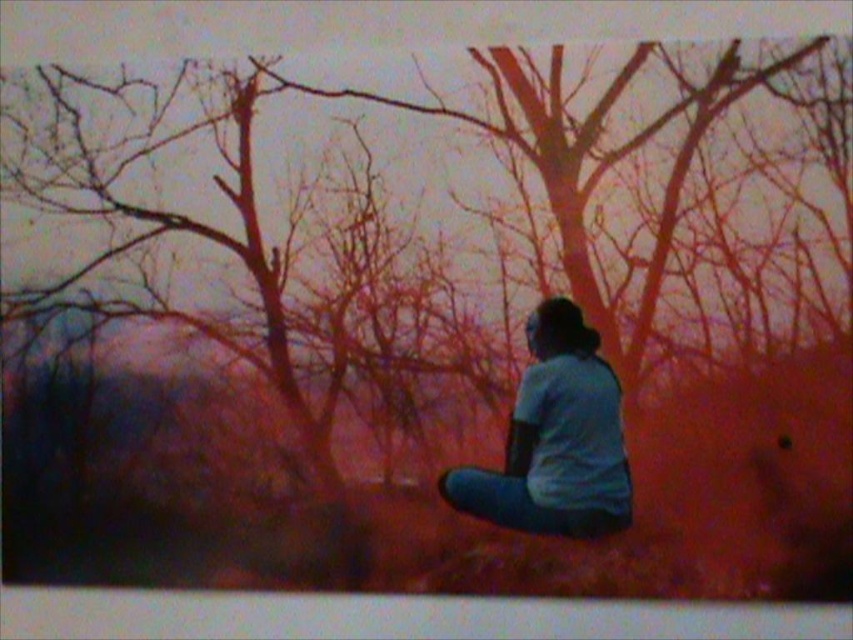
In the scene shown: Who is positioned more to the right, smooth bark tree at center or light blue fabric shirt at center?

light blue fabric shirt at center

This screenshot has width=853, height=640. What do you see at coordinates (526, 154) in the screenshot?
I see `smooth bark tree at center` at bounding box center [526, 154].

The image size is (853, 640). Identify the location of smooth bark tree at center. (526, 154).